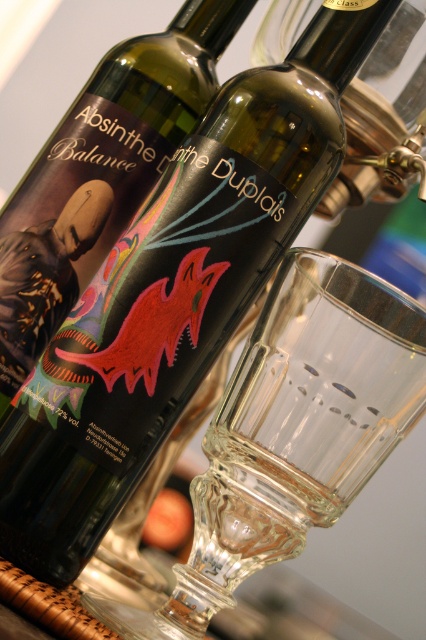
You are a bartender preparing a drink and need to place a sugar cube on the transparent glass at center. Given that the coordinates of the transparent glass are point (x=291, y=433), can you confirm if this point is within the area of the glass?

The transparent glass at center is represented by point (x=291, y=433), so yes, the coordinates are correct for placing the sugar cube there.

You are a bartender preparing a drink and need to place the transparent glass at center to the left of the matte black absinthe balance bottle at center. Is the current arrangement correct?

The transparent glass at center is currently on the right side of the matte black absinthe balance bottle at center, so the current arrangement is incorrect. You need to move the transparent glass at center to the left side of the matte black absinthe balance bottle at center to meet the requirement.

You are a bartender trying to place a new absinthe bottle on the counter. The spot you want to use is at point (362,376). If your new bottle is 7 inches tall, will it fit without falling off the counter?

The point (362,376) is 8.03 inches away from the camera, so placing a 7 inch tall bottle there would be safe as it won not fall off.